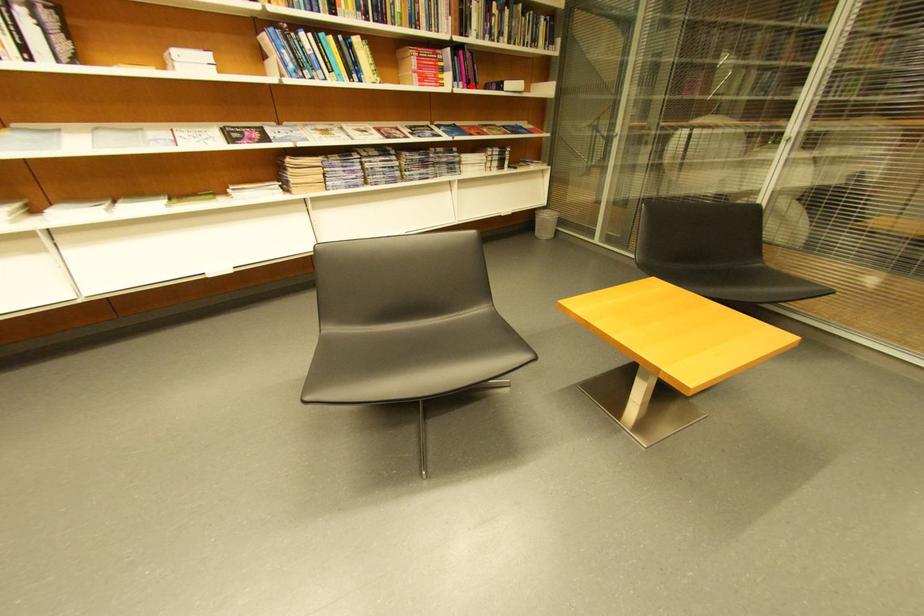
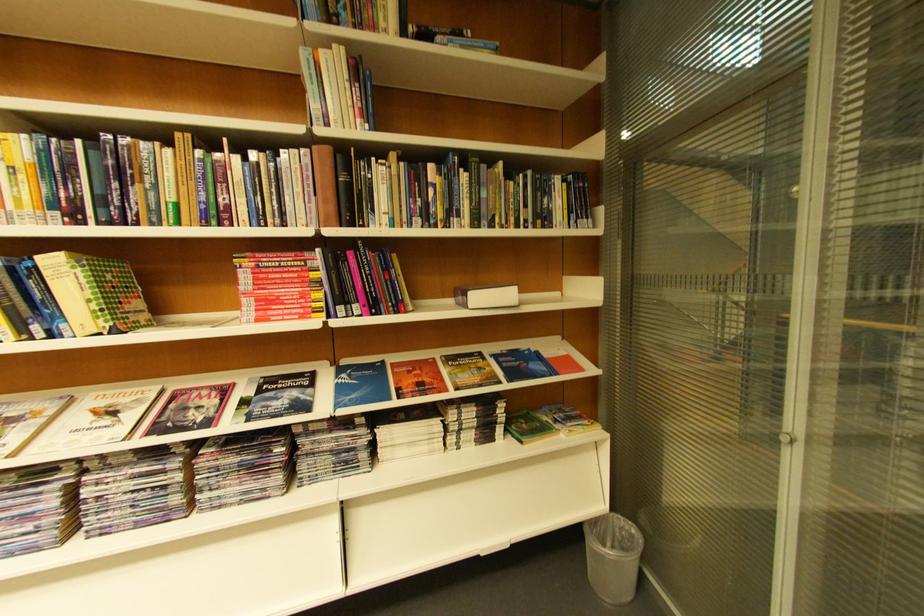
Question: I am providing you with two images of the same scene from different viewpoints. A red point is shown in image1. For the corresponding object point in image2, is it positioned nearer or farther from the camera?

Choices:
 (A) Nearer
 (B) Farther

Answer: (B)